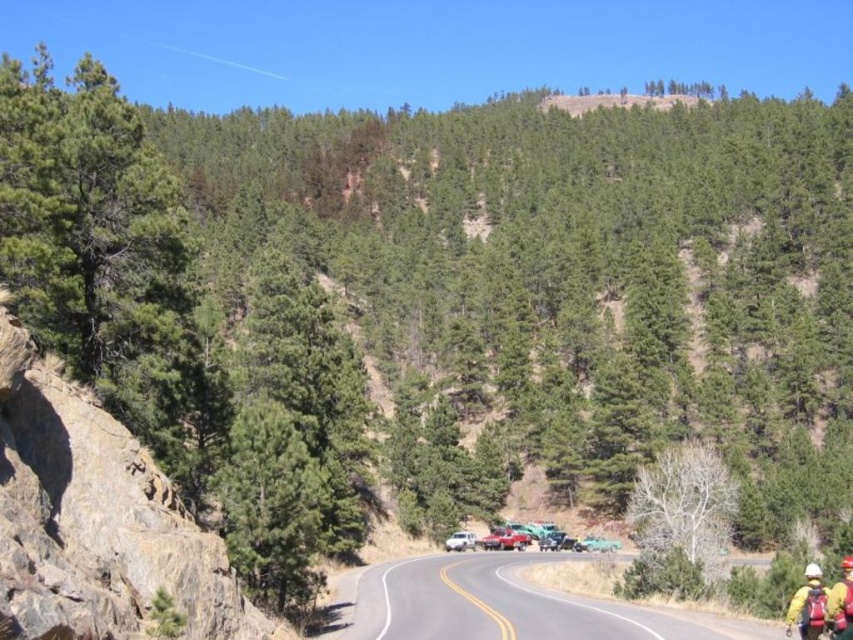
Which is above, smooth asphalt road at center or yellow reflective vest at lower right?

yellow reflective vest at lower right is higher up.

Does smooth asphalt road at center appear under yellow reflective vest at lower right?

Indeed, smooth asphalt road at center is positioned under yellow reflective vest at lower right.

Identify the location of smooth asphalt road at center. Image resolution: width=853 pixels, height=640 pixels. (511, 605).

Looking at this image, is yellow reflective vest at lower right positioned in front of yellow fabric helmet at lower right?

No, it is not.

Does yellow reflective vest at lower right appear under yellow fabric helmet at lower right?

Indeed, yellow reflective vest at lower right is positioned under yellow fabric helmet at lower right.

Identify the location of yellow reflective vest at lower right. The width and height of the screenshot is (853, 640). (808, 605).

Between smooth asphalt road at center and yellow fabric helmet at lower right, which one is positioned higher?

yellow fabric helmet at lower right is higher up.

Consider the image. Does smooth asphalt road at center appear on the right side of yellow fabric helmet at lower right?

No, smooth asphalt road at center is not to the right of yellow fabric helmet at lower right.

Where is `smooth asphalt road at center`? smooth asphalt road at center is located at coordinates (511, 605).